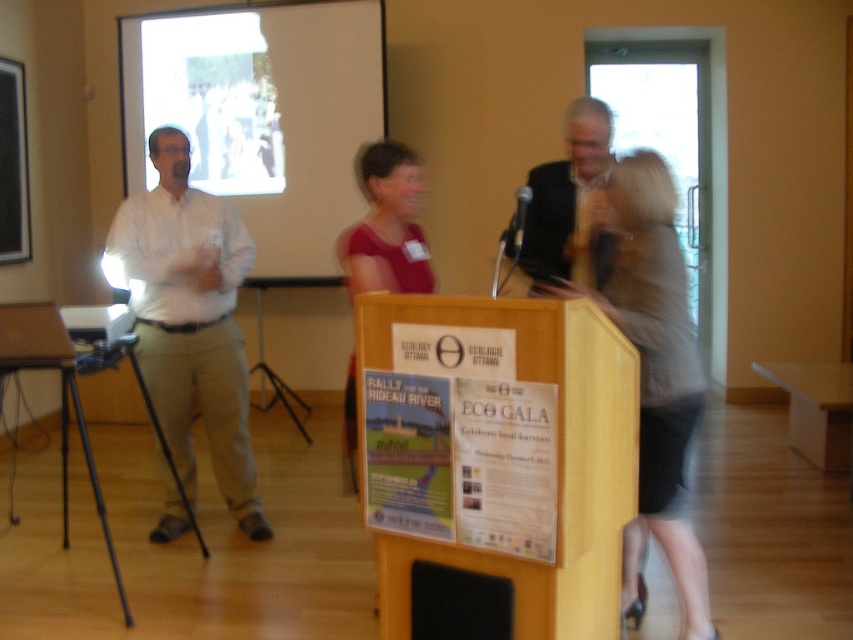
Does point (666, 182) come behind point (68, 337)?

No, it is in front of (68, 337).

Who is lower down, silky gray dress at center or matte black projector at left?

silky gray dress at center

Who is more distant from viewer, (694, 388) or (91, 337)?

Positioned behind is point (91, 337).

At what (x,y) coordinates should I click in order to perform the action: click on silky gray dress at center. Please return your answer as a coordinate pair (x, y). Looking at the image, I should click on (654, 374).

Image resolution: width=853 pixels, height=640 pixels. Describe the element at coordinates (262, 116) in the screenshot. I see `white matte projection screen at upper center` at that location.

Which is more to the left, white matte projection screen at upper center or silky gray dress at center?

white matte projection screen at upper center is more to the left.

What do you see at coordinates (262, 116) in the screenshot? This screenshot has width=853, height=640. I see `white matte projection screen at upper center` at bounding box center [262, 116].

Find the location of a particular element. This screenshot has height=640, width=853. white matte projection screen at upper center is located at coordinates (262, 116).

Can you confirm if white matte projection screen at upper center is positioned below black plastic microphone at center?

Incorrect, white matte projection screen at upper center is not positioned below black plastic microphone at center.

Can you confirm if white matte projection screen at upper center is taller than black plastic microphone at center?

Correct, white matte projection screen at upper center is much taller as black plastic microphone at center.

Is point (274, 184) farther from camera compared to point (521, 196)?

Yes, it is.

Where is `white matte projection screen at upper center`? The image size is (853, 640). white matte projection screen at upper center is located at coordinates (262, 116).